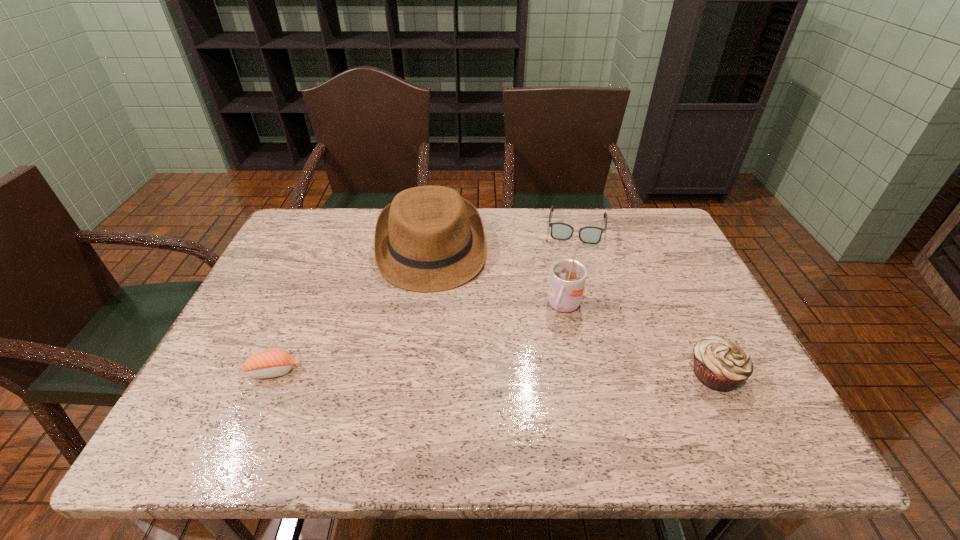
Where is `muffin located at the near edge`? This screenshot has width=960, height=540. muffin located at the near edge is located at coordinates (720, 363).

Locate an element on the screen. object that is at the left edge is located at coordinates (271, 363).

At what (x,y) coordinates should I click in order to perform the action: click on object that is positioned at the right edge. Please return your answer as a coordinate pair (x, y). This screenshot has height=540, width=960. Looking at the image, I should click on (720, 363).

The image size is (960, 540). I want to click on object at the near left corner, so click(271, 363).

At what (x,y) coordinates should I click in order to perform the action: click on object located at the near right corner. Please return your answer as a coordinate pair (x, y). Image resolution: width=960 pixels, height=540 pixels. Looking at the image, I should click on (720, 363).

What are the coordinates of `vacant area at the far edge of the desktop` in the screenshot? It's located at (357, 226).

You are a GUI agent. You are given a task and a screenshot of the screen. Output one action in this format:
    pyautogui.click(x=<x>, y=<y>)
    Task: Click on the free space at the near edge
    The width and height of the screenshot is (960, 540).
    Given the screenshot: What is the action you would take?
    pyautogui.click(x=391, y=380)

The image size is (960, 540). In the image, there is a desktop. In order to click on free space at the left edge in this screenshot , I will do `click(298, 322)`.

At what (x,y) coordinates should I click in order to perform the action: click on vacant space at the right edge of the desktop. Please return your answer as a coordinate pair (x, y). Looking at the image, I should click on point(649,274).

The height and width of the screenshot is (540, 960). What are the coordinates of `free space at the far left corner of the desktop` in the screenshot? It's located at (314, 253).